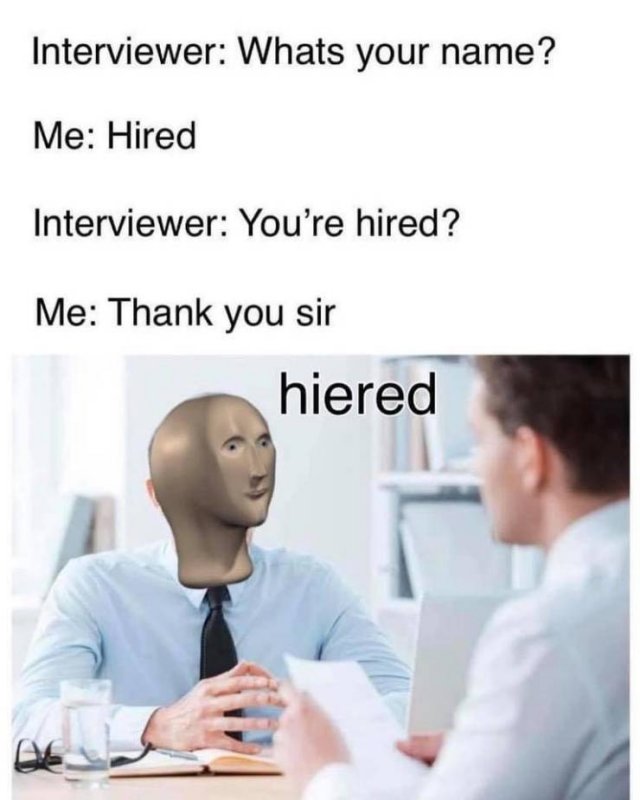
Locate an element on the screen. The width and height of the screenshot is (640, 800). book is located at coordinates [x=173, y=765], [x=234, y=758].